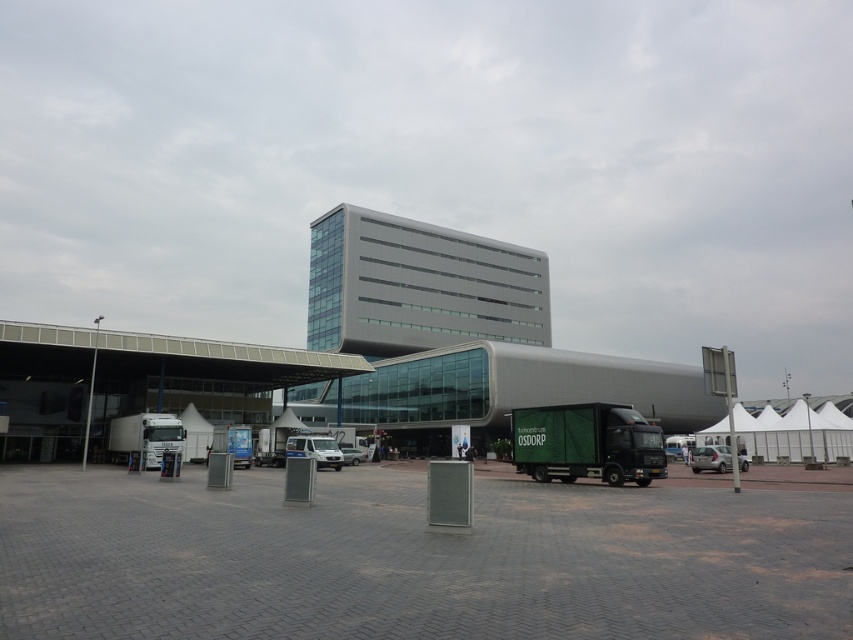
Question: From the image, what is the correct spatial relationship of white fabric tent at lower right in relation to silver metallic sedan at lower right?

Choices:
 (A) right
 (B) left

Answer: (A)

Question: Where is green matte truck at lower right located in relation to white matte van at center in the image?

Choices:
 (A) left
 (B) right

Answer: (B)

Question: Based on their relative distances, which object is farther from the silver metallic van at center?

Choices:
 (A) white glossy truck at left
 (B) green matte truck at lower right
 (C) white fabric tent at lower right
 (D) silver metallic sedan at lower right

Answer: (C)

Question: Which object is farther from the camera taking this photo?

Choices:
 (A) white fabric tent at lower right
 (B) white glossy truck at left
 (C) silver metallic van at center
 (D) green matte truck at lower right

Answer: (A)

Question: Among these points, which one is nearest to the camera?

Choices:
 (A) click(x=593, y=468)
 (B) click(x=737, y=465)
 (C) click(x=314, y=444)

Answer: (A)

Question: Is green matte truck at lower right smaller than white glossy truck at left?

Choices:
 (A) no
 (B) yes

Answer: (B)